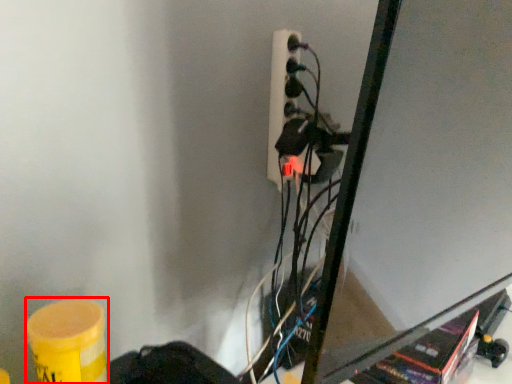
Question: From the image's perspective, where is barrel (annotated by the red box) located relative to power plugs and sockets?

Choices:
 (A) below
 (B) above

Answer: (A)